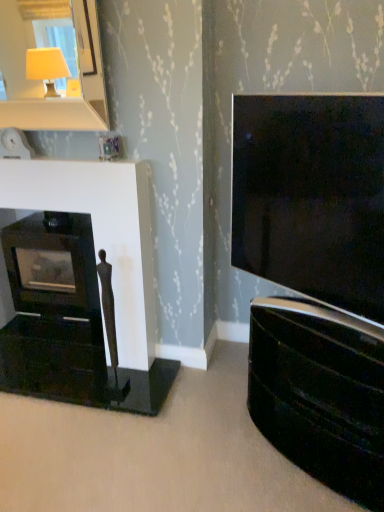
Where is `vacant area on top of matte black fireplace at left (from a real-world perspective)`? Image resolution: width=384 pixels, height=512 pixels. vacant area on top of matte black fireplace at left (from a real-world perspective) is located at coordinates (46, 158).